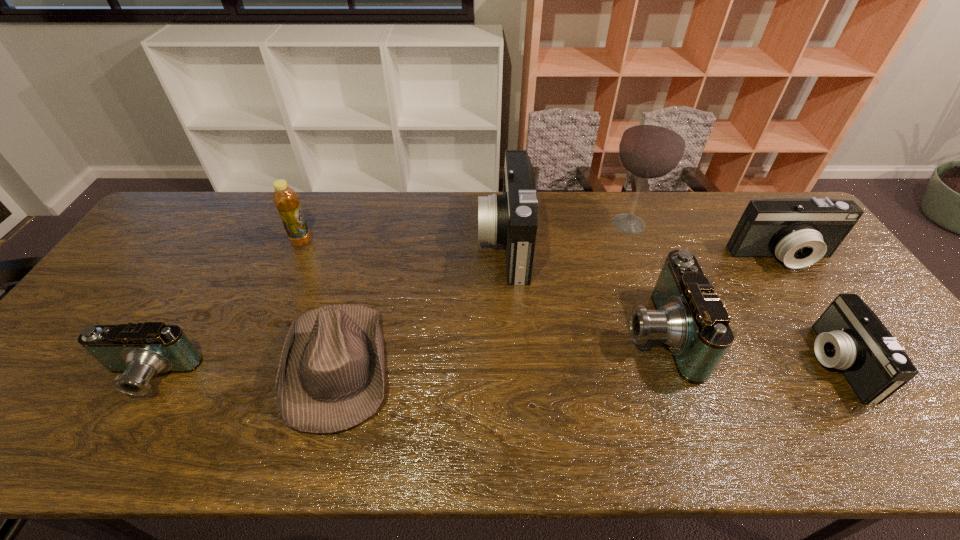
At what (x,y) coordinates should I click in order to perform the action: click on alcohol. Please return your answer as a coordinate pair (x, y). This screenshot has height=540, width=960. Looking at the image, I should click on tap(652, 146).

Find the location of `red alcohol`. red alcohol is located at coordinates (652, 146).

At what (x,y) coordinates should I click in order to perform the action: click on the second camcorder from left to right. Please return your answer as a coordinate pair (x, y). The height and width of the screenshot is (540, 960). Looking at the image, I should click on (510, 218).

Where is `the biggest black camcorder`? The height and width of the screenshot is (540, 960). the biggest black camcorder is located at coordinates (510, 218).

Locate an element on the screen. This screenshot has height=540, width=960. the second object from left to right is located at coordinates (286, 201).

Find the location of a particular element. The width and height of the screenshot is (960, 540). the second biggest black camcorder is located at coordinates (798, 231).

Identify the location of the third camcorder from left to right. This screenshot has width=960, height=540. (689, 318).

In order to click on the bigger blue camcorder in this screenshot , I will do `click(689, 318)`.

What are the coordinates of `the nearest black camcorder` in the screenshot? It's located at point(850,337).

Locate an element on the screen. the smaller blue camcorder is located at coordinates [x=140, y=351].